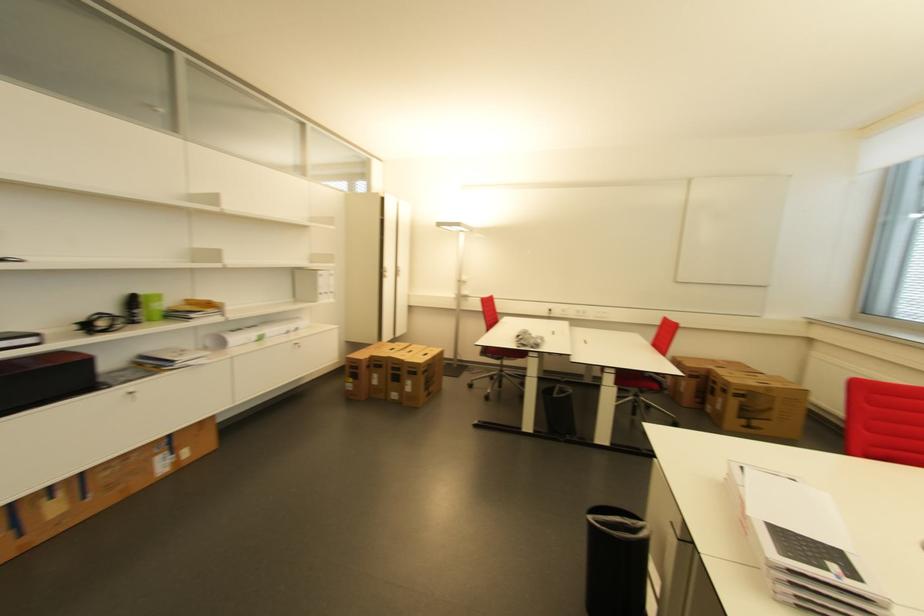
At what (x,y) coordinates should I click in order to perform the action: click on red chair sitting surface. Please return your answer as a coordinate pair (x, y). This screenshot has width=924, height=616. Looking at the image, I should click on click(637, 384).